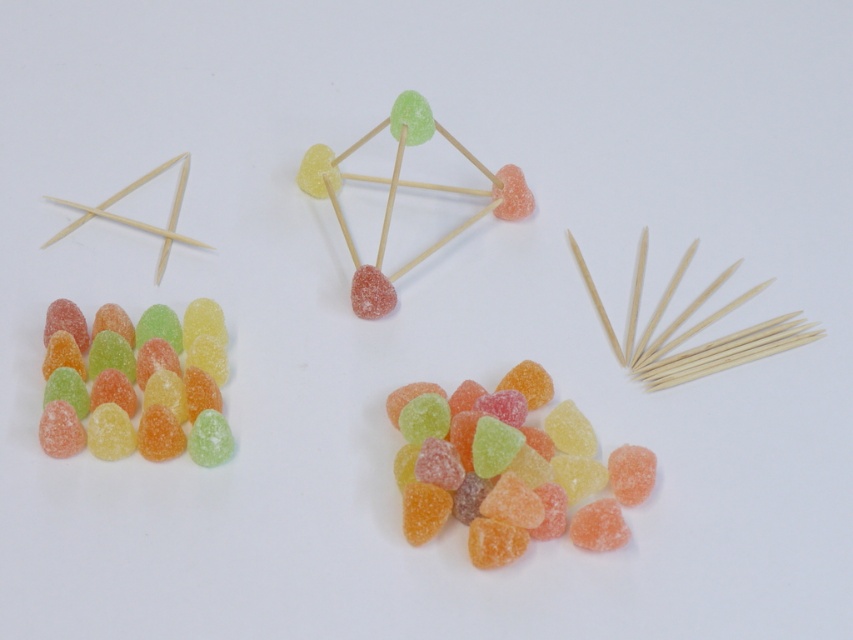
Question: Which object appears closest to the camera in this image?

Choices:
 (A) glossy sugar-coated candies at center
 (B) sugary translucent candies at left

Answer: (A)

Question: Can you confirm if glossy sugar-coated candies at center is wider than sugary translucent candies at left?

Choices:
 (A) no
 (B) yes

Answer: (B)

Question: Which point is farther from the camera taking this photo?

Choices:
 (A) (64, 449)
 (B) (474, 474)

Answer: (B)

Question: Which point is closer to the camera?

Choices:
 (A) sugary translucent candies at left
 (B) glossy sugar-coated candies at center

Answer: (B)

Question: Is glossy sugar-coated candies at center wider than sugary translucent candies at left?

Choices:
 (A) no
 (B) yes

Answer: (B)

Question: Does glossy sugar-coated candies at center have a greater width compared to sugary translucent candies at left?

Choices:
 (A) yes
 (B) no

Answer: (A)